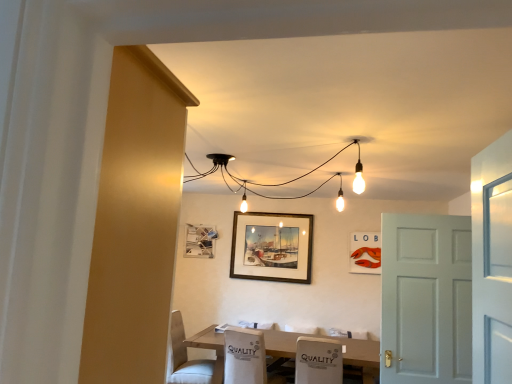
Question: Is metallic silver picture frame at lower left, the third picture frame viewed from the right, inside the boundaries of matte plastic picture frame at upper right, which appears as the 1th picture frame when viewed from the right, or outside?

Choices:
 (A) inside
 (B) outside

Answer: (B)

Question: In terms of width, does metallic silver picture frame at lower left, the third picture frame viewed from the right, look wider or thinner when compared to matte plastic picture frame at upper right, which ranks as the third picture frame in left-to-right order?

Choices:
 (A) thin
 (B) wide

Answer: (B)

Question: Estimate the real-world distances between objects in this image. Which object is farther from the wooden picture frame at center, which ranks as the second picture frame in right-to-left order?

Choices:
 (A) white matte door at right
 (B) matte plastic picture frame at upper right, which appears as the 1th picture frame when viewed from the right
 (C) white wood table at center
 (D) white fabric chair at lower left, positioned as the 1th chair in left-to-right order
 (E) white fabric armchair at lower center

Answer: (A)

Question: Based on their relative distances, which object is farther from the white wood table at center?

Choices:
 (A) metallic silver picture frame at lower left, the third picture frame viewed from the right
 (B) white fabric chair at lower center, positioned as the second chair in left-to-right order
 (C) white fabric chair at lower left, positioned as the 1th chair in left-to-right order
 (D) white fabric armchair at lower center
 (E) wooden picture frame at center, which ranks as the second picture frame in right-to-left order

Answer: (E)